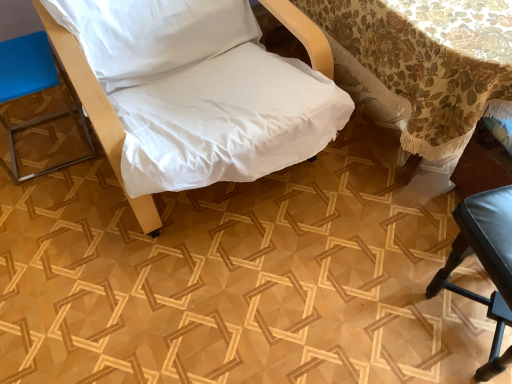
Locate an element on the screen. The width and height of the screenshot is (512, 384). vacant space underneath black leather chair at lower right, placed as the third furniture when sorted from left to right (from a real-world perspective) is located at coordinates (470, 319).